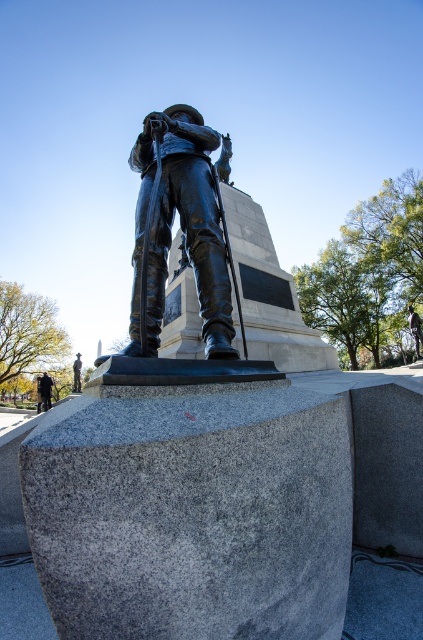
Question: Can you confirm if bronze statue at center is wider than dark brown leather jacket at lower left?

Choices:
 (A) no
 (B) yes

Answer: (A)

Question: Can you confirm if bronze statue at center is bigger than dark brown leather jacket at lower left?

Choices:
 (A) no
 (B) yes

Answer: (A)

Question: Does bronze statue at center appear under dark brown leather jacket at lower left?

Choices:
 (A) yes
 (B) no

Answer: (B)

Question: Which object is closer to the camera taking this photo?

Choices:
 (A) dark brown leather jacket at lower left
 (B) bronze statue at center

Answer: (B)